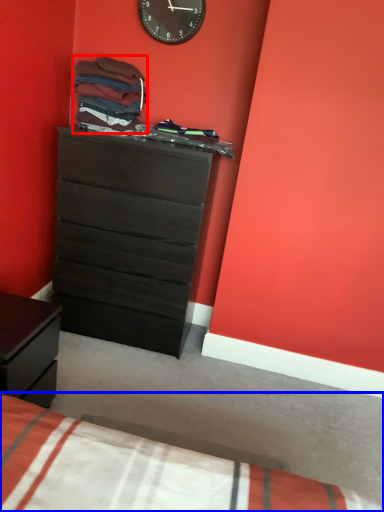
Question: Among these objects, which one is farthest to the camera, clothing (highlighted by a red box) or bed (highlighted by a blue box)?

Choices:
 (A) clothing
 (B) bed

Answer: (A)